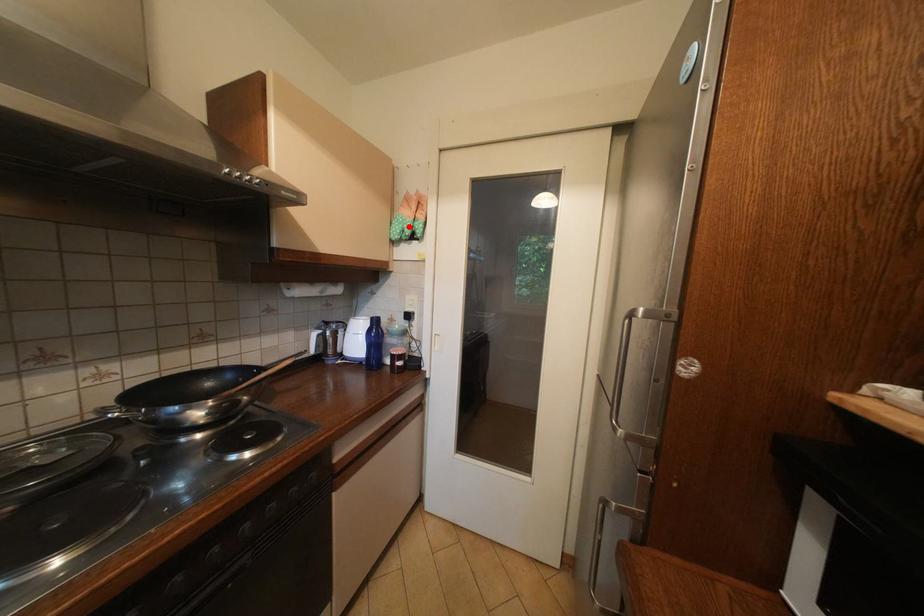
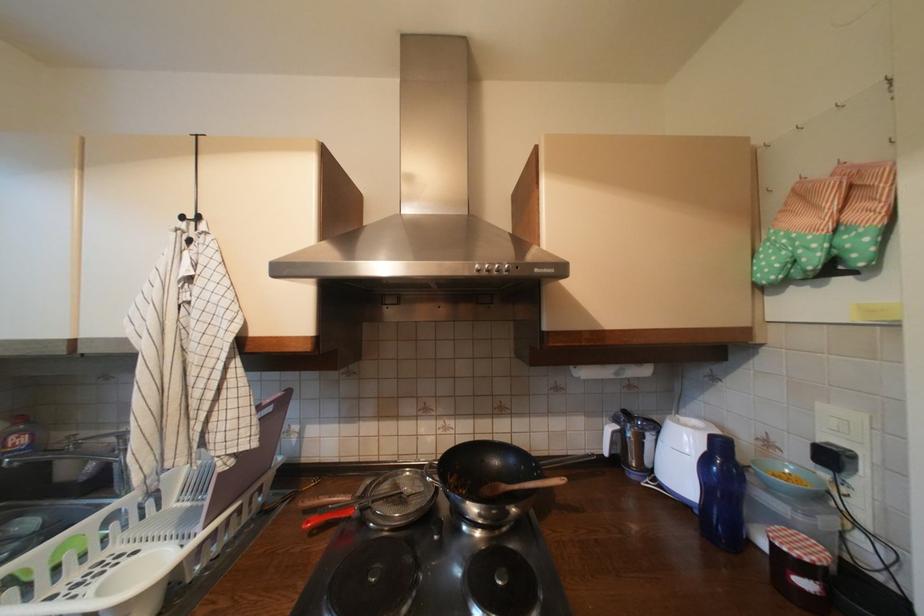
In the second image, find the point that corresponds to the highlighted location in the first image.

(793, 254)